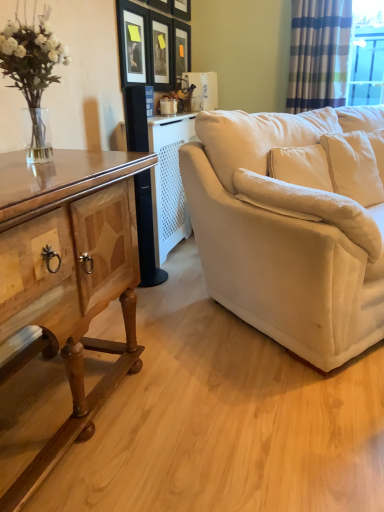
Find the location of `unoccupied region to the right of wooden cabinet at left`. unoccupied region to the right of wooden cabinet at left is located at coordinates (220, 410).